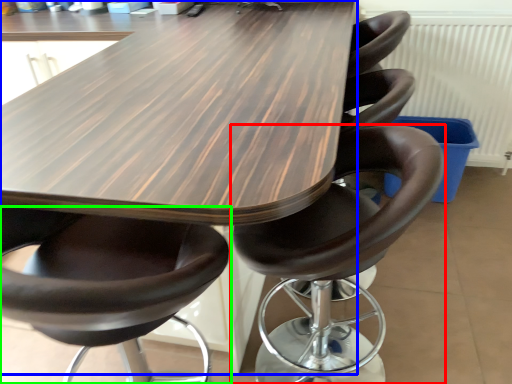
Question: Based on their relative distances, which object is farther from chair (highlighted by a red box)? Choose from table (highlighted by a blue box) and chair (highlighted by a green box).

Choices:
 (A) table
 (B) chair

Answer: (A)